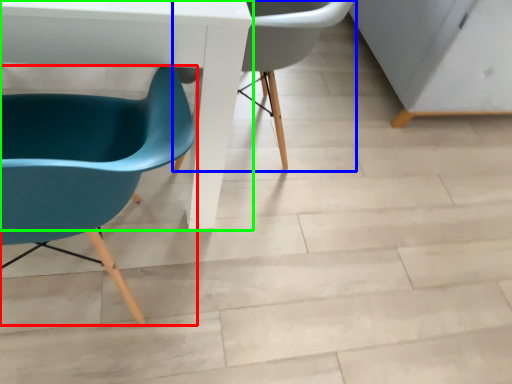
Question: Which is nearer to the chair (highlighted by a red box)? chair (highlighted by a blue box) or table (highlighted by a green box).

Choices:
 (A) chair
 (B) table

Answer: (B)